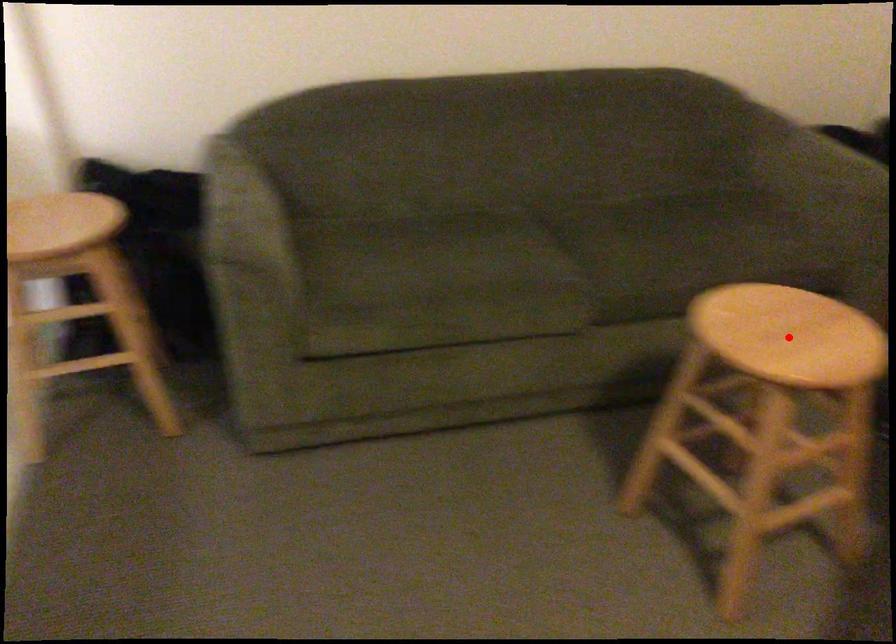
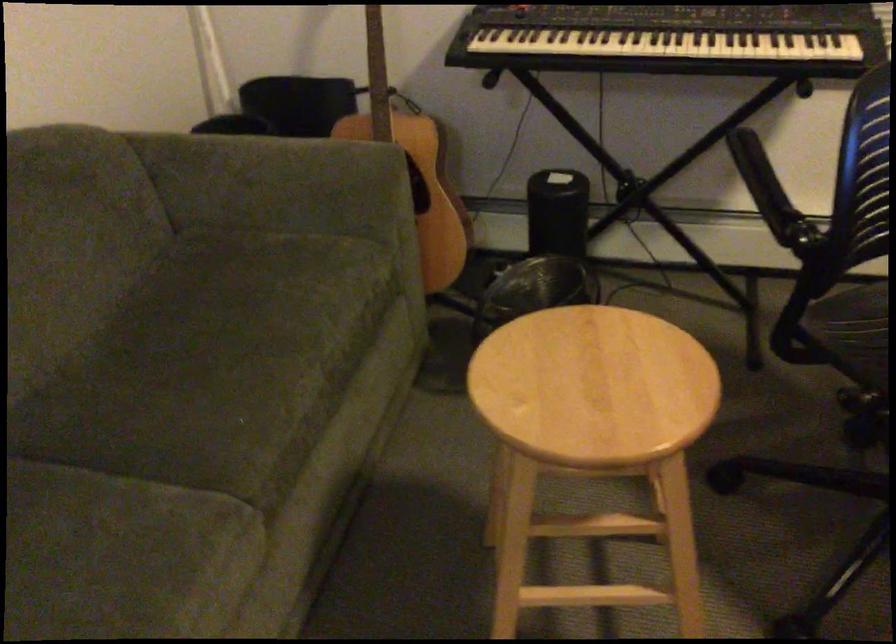
Question: I am providing you with two images of the same scene from different viewpoints. In image1, a red point is highlighted. Considering the same 3D point in image2, which of the following is correct?

Choices:
 (A) It is closer
 (B) It is farther

Answer: (A)